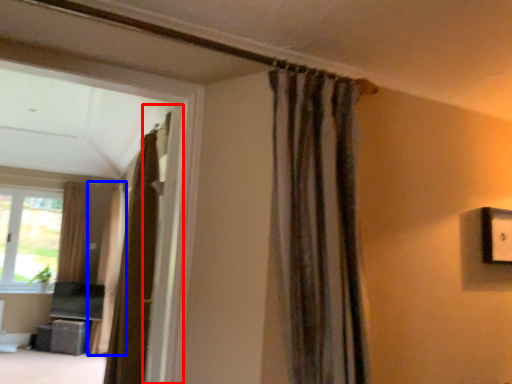
Question: Which point is further to the camera, screen door (highlighted by a red box) or curtain (highlighted by a blue box)?

Choices:
 (A) screen door
 (B) curtain

Answer: (B)